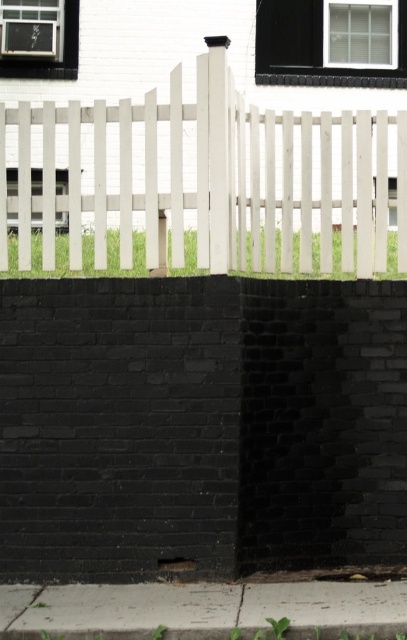
You are a painter planning to paint the white wood fence at center and the gray concrete pavement at lower center. Since you want to use the right amount of paint, you need to know which one is wider. Which object is wider?

The white wood fence at center is wider than the gray concrete pavement at lower center according to the description.

You are a delivery person trying to park your bike. The bike has a kickstand that needs to be placed on a stable surface. Based on the scene, which object should you choose between the white wood fence at center and the gray concrete pavement at lower center?

The gray concrete pavement at lower center is a stable surface for the bike kickstand since the white wood fence at center is located above it and likely cannot support the kickstand.